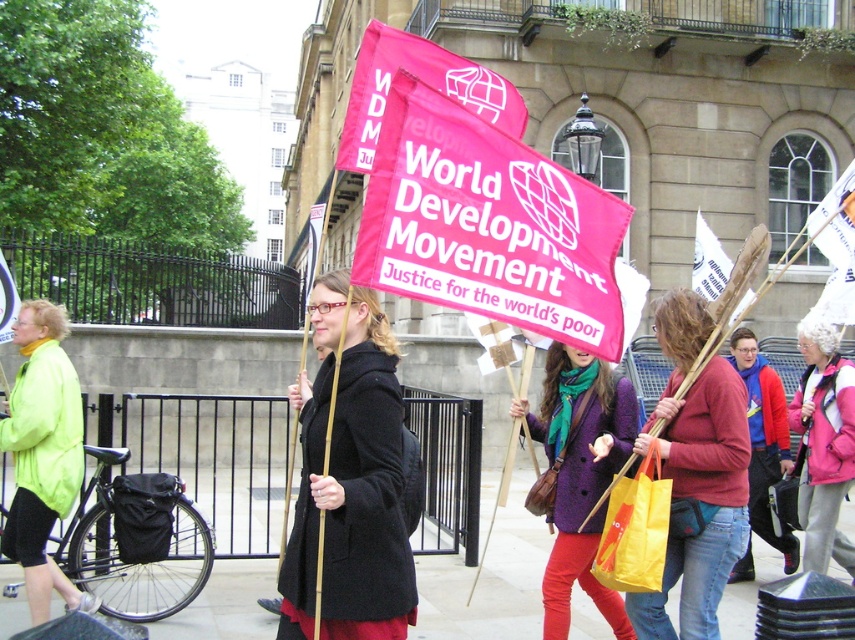
Can you confirm if matte black coat at center is shorter than purple wool coat at center?

Yes, matte black coat at center is shorter than purple wool coat at center.

Looking at this image, between matte black coat at center and purple wool coat at center, which one is positioned lower?

purple wool coat at center

Is point (302, 419) more distant than point (608, 401)?

No, (302, 419) is closer to viewer.

Locate an element on the screen. matte black coat at center is located at coordinates (351, 481).

Can you confirm if matte pink scarf at center is wider than purple wool coat at center?

In fact, matte pink scarf at center might be narrower than purple wool coat at center.

How distant is matte pink scarf at center from purple wool coat at center?

18.27 inches

The width and height of the screenshot is (855, 640). I want to click on matte pink scarf at center, so click(x=697, y=474).

Based on the photo, which is above, matte black coat at center or matte pink scarf at center?

Positioned higher is matte black coat at center.

Is matte black coat at center smaller than matte pink scarf at center?

No.

You are a GUI agent. You are given a task and a screenshot of the screen. Output one action in this format:
    pyautogui.click(x=<x>, y=<y>)
    Task: Click on the matte black coat at center
    The width and height of the screenshot is (855, 640).
    Given the screenshot: What is the action you would take?
    pyautogui.click(x=351, y=481)